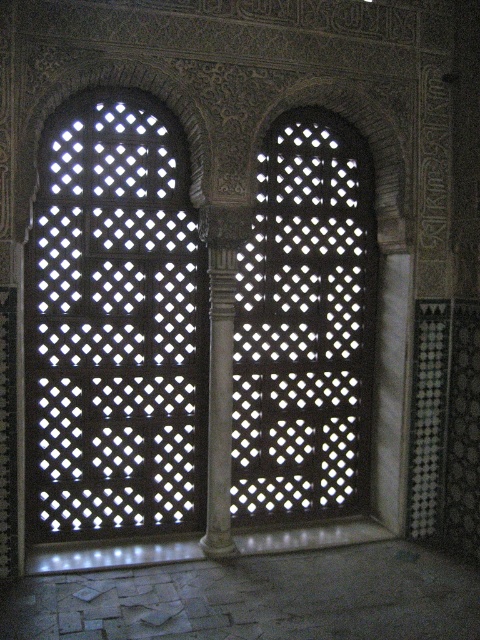
You are an architect examining the symmetry of the interior. You notice the translucent glass lattice at center and the white marble column at center. Which object is positioned to the right of the other?

The translucent glass lattice at center is to the right of the white marble column at center.

You are an architect designing a new building inspired by this historical style. You need to ensure that the translucent glass lattice at center and the white marble column at center maintain their original spatial relationship. Which object should be placed higher in your design?

The translucent glass lattice at center should be placed higher than the white marble column at center to maintain their original spatial relationship as shown in the image.

You are an architect examining the interior design of this historical building. You notice the translucent glass lattice at left and the white marble column at center. Which object is located higher up in the image?

The translucent glass lattice at left is positioned over the white marble column at center, meaning it is higher up in the image.